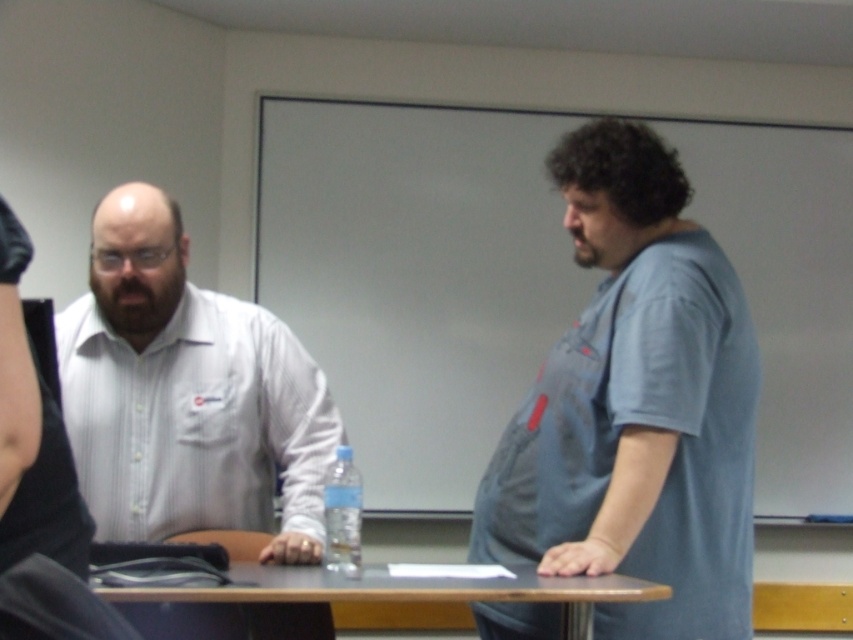
You are an observer in the room. You notice the blue cotton shirt at right and the brown wood table at center. Which object is taller?

The blue cotton shirt at right is taller than the brown wood table at center.

You are a guest in this room and need to place a small notebook on the brown wood table at center. However, there is a clear plastic bottle at center in the way. Can you move the bottle to the left to make space?

The brown wood table at center is to the right of the clear plastic bottle at center, so moving the clear plastic bottle at center to the left would bring it closer to the edge of the table, creating space on the right side for the notebook.